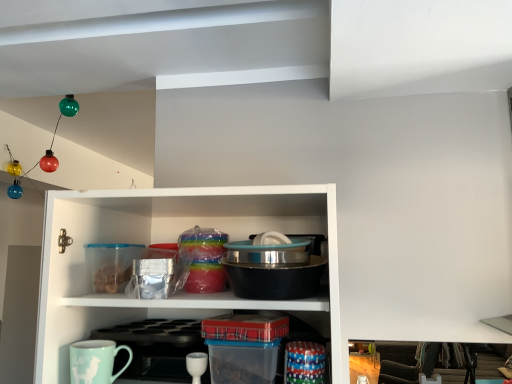
Question: Does teal glossy mug at lower left appear on the right side of stainless steel bowl at center?

Choices:
 (A) yes
 (B) no

Answer: (B)

Question: Is teal glossy mug at lower left thinner than stainless steel bowl at center?

Choices:
 (A) no
 (B) yes

Answer: (B)

Question: From the image's perspective, would you say teal glossy mug at lower left is positioned over stainless steel bowl at center?

Choices:
 (A) yes
 (B) no

Answer: (B)

Question: Is teal glossy mug at lower left positioned in front of stainless steel bowl at center?

Choices:
 (A) yes
 (B) no

Answer: (B)

Question: Is teal glossy mug at lower left oriented towards stainless steel bowl at center?

Choices:
 (A) no
 (B) yes

Answer: (A)

Question: From the image's perspective, is teal glossy mug at lower left above or below white glossy cup at lower center?

Choices:
 (A) below
 (B) above

Answer: (B)

Question: Visually, is teal glossy mug at lower left positioned to the left or to the right of white glossy cup at lower center?

Choices:
 (A) left
 (B) right

Answer: (A)

Question: Is point (131, 357) positioned closer to the camera than point (204, 365)?

Choices:
 (A) farther
 (B) closer

Answer: (A)

Question: From a real-world perspective, is teal glossy mug at lower left physically located above or below white glossy cup at lower center?

Choices:
 (A) below
 (B) above

Answer: (B)

Question: From a real-world perspective, is teal glossy mug at lower left physically located above or below stainless steel bowl at center?

Choices:
 (A) above
 (B) below

Answer: (B)

Question: Is teal glossy mug at lower left inside or outside of stainless steel bowl at center?

Choices:
 (A) outside
 (B) inside

Answer: (A)

Question: Is teal glossy mug at lower left wider or thinner than stainless steel bowl at center?

Choices:
 (A) wide
 (B) thin

Answer: (B)

Question: In terms of size, does teal glossy mug at lower left appear bigger or smaller than stainless steel bowl at center?

Choices:
 (A) small
 (B) big

Answer: (A)

Question: Is white glossy cup at lower center wider or thinner than teal glossy mug at lower left?

Choices:
 (A) wide
 (B) thin

Answer: (A)

Question: Is white glossy cup at lower center bigger or smaller than teal glossy mug at lower left?

Choices:
 (A) big
 (B) small

Answer: (B)